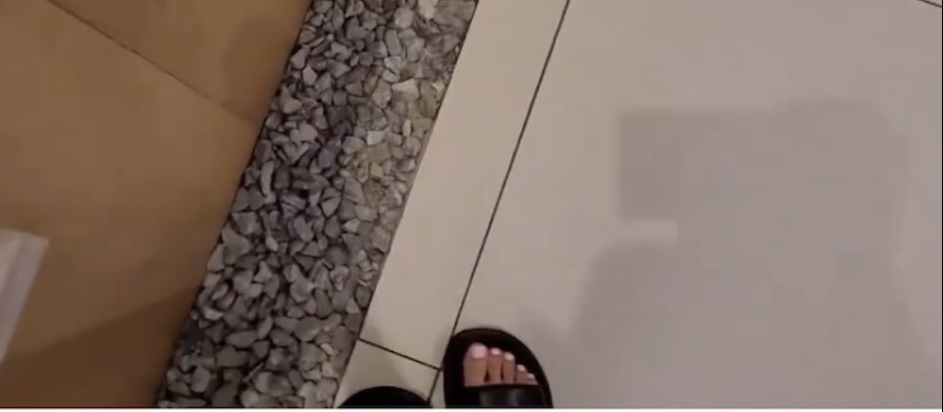
Where is `wall`? The width and height of the screenshot is (943, 412). wall is located at coordinates (95, 127).